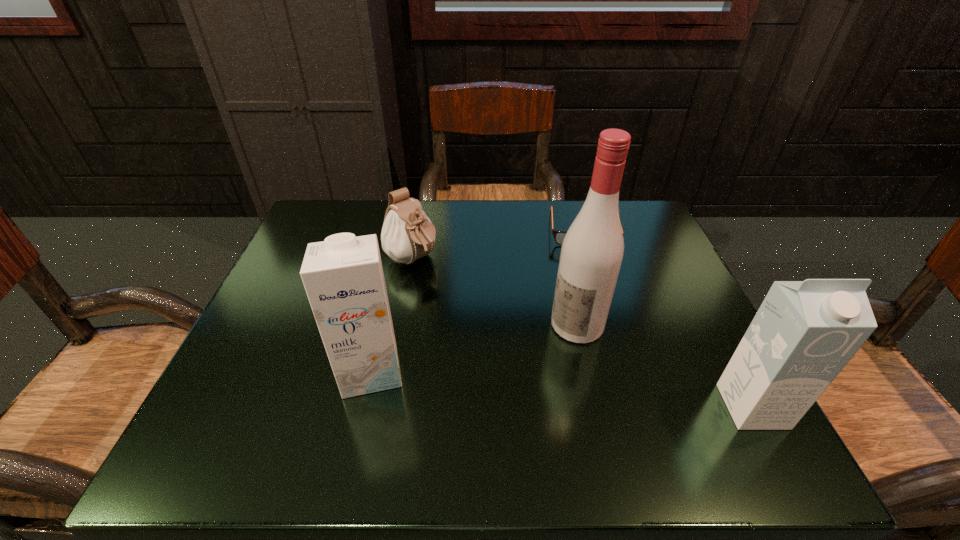
The height and width of the screenshot is (540, 960). What are the coordinates of `free spot between the pouch and the alcohol` in the screenshot? It's located at [494, 292].

Find the location of a particular element. The image size is (960, 540). free area in between the spectacles and the pouch is located at coordinates (497, 245).

Locate an element on the screen. vacant space that's between the tallest object and the fourth tallest object is located at coordinates (494, 292).

Where is `vacant space that's between the left carton and the shortest object`? This screenshot has height=540, width=960. vacant space that's between the left carton and the shortest object is located at coordinates (477, 300).

Locate which object is the third closest to the shortest object. Please provide its 2D coordinates. Your answer should be formatted as a tuple, i.e. [(x, y)], where the tuple contains the x and y coordinates of a point satisfying the conditions above.

[(804, 333)]

Find the location of a particular element. object that is the second closest one to the second shortest object is located at coordinates (592, 251).

At what (x,y) coordinates should I click in order to perform the action: click on vacant region that satisfies the following two spatial constraints: 1. on the back side of the pouch; 2. on the right side of the spectacles. Please return your answer as a coordinate pair (x, y). The image size is (960, 540). Looking at the image, I should click on (418, 230).

Where is `vacant region that satisfies the following two spatial constraints: 1. on the back side of the alcohol; 2. on the left side of the shortest object`? Image resolution: width=960 pixels, height=540 pixels. vacant region that satisfies the following two spatial constraints: 1. on the back side of the alcohol; 2. on the left side of the shortest object is located at coordinates (556, 230).

The image size is (960, 540). What are the coordinates of `vacant space that satisfies the following two spatial constraints: 1. on the front side of the alcohol; 2. on the left side of the pouch` in the screenshot? It's located at (399, 325).